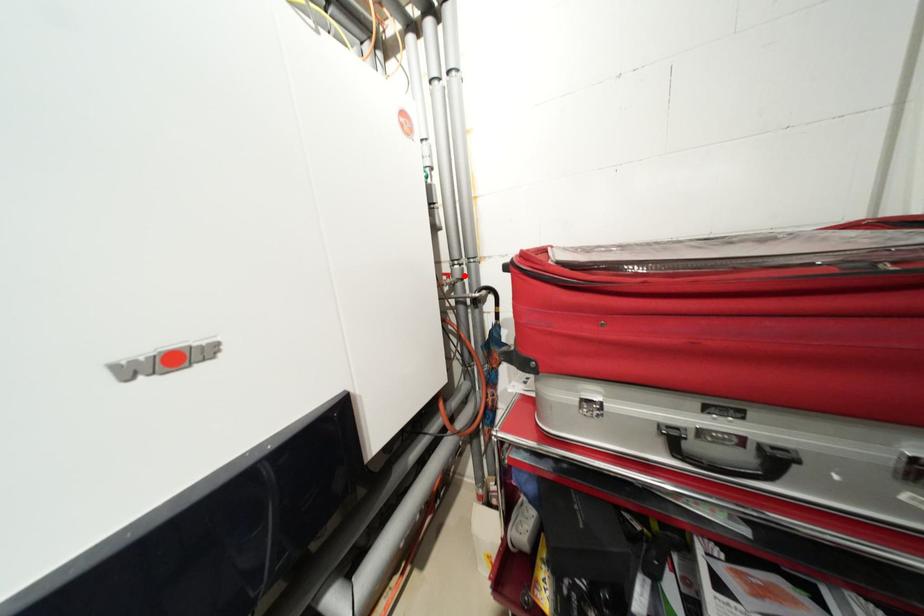
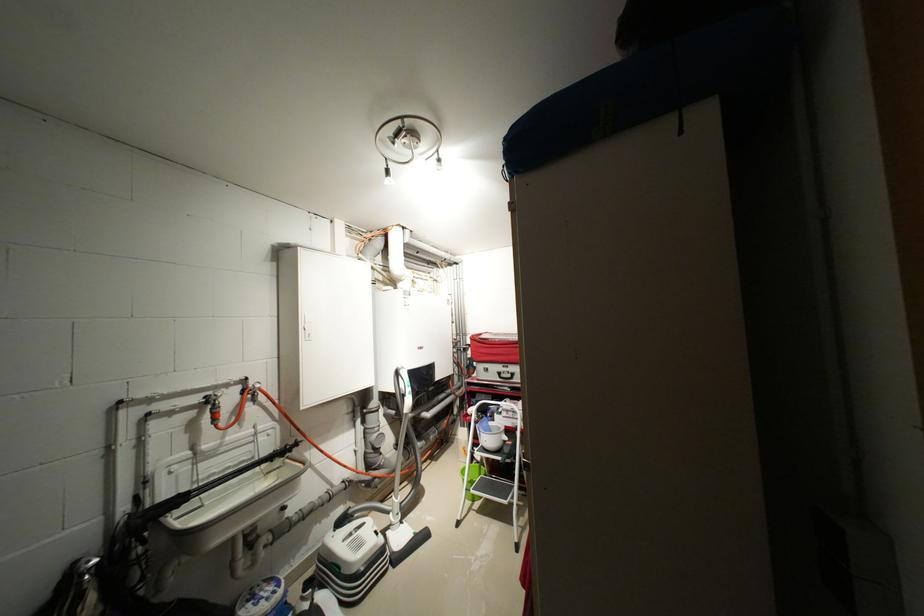
Find the pixel in the second image that matches the highlighted location in the first image.

(466, 341)